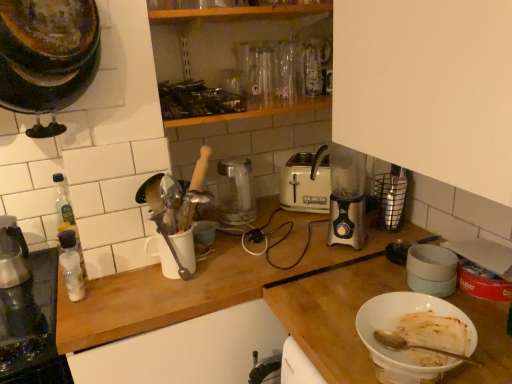
Question: Is metallic glass carafe at left wider or thinner than white plastic toaster at center?

Choices:
 (A) thin
 (B) wide

Answer: (B)

Question: In terms of size, does metallic glass carafe at left appear bigger or smaller than white plastic toaster at center?

Choices:
 (A) small
 (B) big

Answer: (A)

Question: Which object is the farthest from the brushed metal coffee maker at left, the 2th appliance positioned from the right?

Choices:
 (A) clear plastic bottle at left, the second bottle in the back-to-front sequence
 (B) white plastic bottle at left, the 2th bottle viewed from the front
 (C) satin silver blender at right, the first appliance viewed from the right
 (D) white plastic toaster at center
 (E) satin silver kettle at center, placed as the 1th kitchen appliance when sorted from back to front

Answer: (C)

Question: Which of these objects is positioned farthest from the wooden at center, the 1th countertop in the back-to-front sequence?

Choices:
 (A) clear plastic bottle at left, the second bottle in the back-to-front sequence
 (B) white plastic toaster at center
 (C) satin silver blender at right, which appears as the second appliance when viewed from the left
 (D) satin silver kettle at center, which appears as the 2th kitchen appliance when viewed from the right
 (E) white matte bowl at lower right, the 1th bowl positioned from the bottom

Answer: (C)